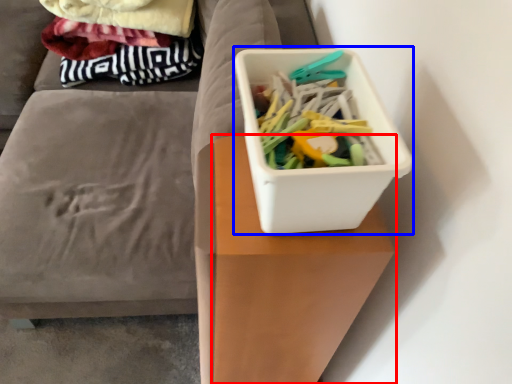
Question: Which of the following is the closest to the observer, table (highlighted by a red box) or storage box (highlighted by a blue box)?

Choices:
 (A) table
 (B) storage box

Answer: (B)